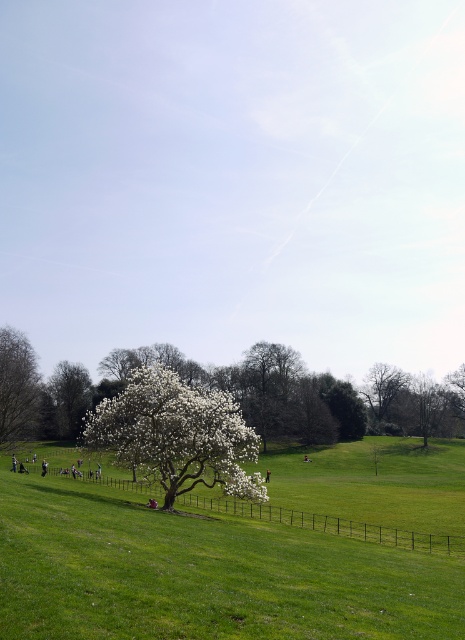
Question: Among these objects, which one is nearest to the camera?

Choices:
 (A) bare branches tree at upper right
 (B) white textured tree at left
 (C) white fluffy blossoms at center
 (D) white textured tree at center-left

Answer: (C)

Question: Which is farther from the white textured tree at left?

Choices:
 (A) bare branches tree at upper right
 (B) white textured tree at center-left
 (C) white fluffy blossoms at center

Answer: (A)

Question: Does white fluffy blossoms at center have a larger size compared to white textured tree at left?

Choices:
 (A) yes
 (B) no

Answer: (A)

Question: Which object is positioned farthest from the bare branches tree at upper right?

Choices:
 (A) green grassy field at center
 (B) white textured tree at left
 (C) white fluffy blossoms at center
 (D) white textured tree at center-left

Answer: (B)

Question: Considering the relative positions of white textured tree at left and white textured tree at center-left in the image provided, where is white textured tree at left located with respect to white textured tree at center-left?

Choices:
 (A) right
 (B) left

Answer: (A)

Question: Is white fluffy blossoms at center bigger than bare branches tree at upper right?

Choices:
 (A) no
 (B) yes

Answer: (B)